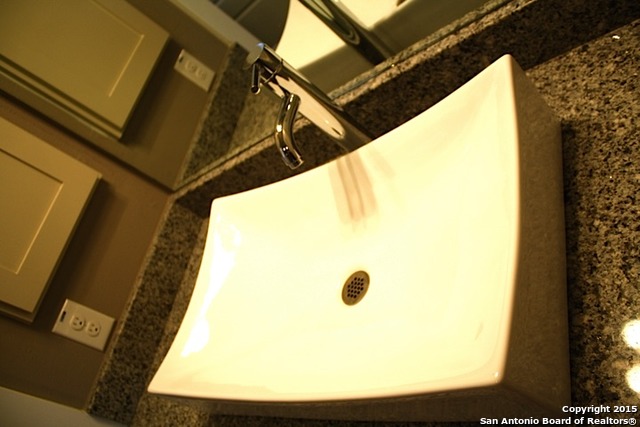
I want to click on cabinet door, so click(57, 219).